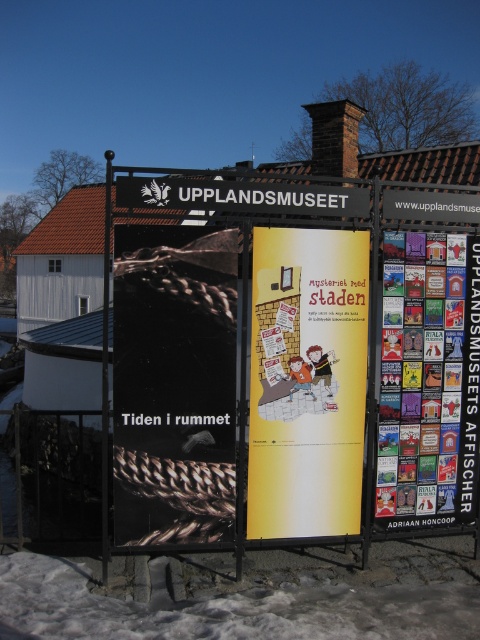
Which is above, black matte poster at center or white powdery snow at lower left?

Positioned higher is black matte poster at center.

Between point (264, 436) and point (79, 636), which one is positioned behind?

Positioned behind is point (264, 436).

Is point (216, 365) closer to camera compared to point (384, 611)?

No, it is behind (384, 611).

Locate an element on the screen. This screenshot has height=640, width=480. black matte poster at center is located at coordinates (296, 342).

Who is more distant from viewer, (253, 360) or (452, 444)?

Positioned behind is point (452, 444).

In the scene shown: Which is more to the left, yellow paper poster at center or multicolored paper posters at right?

yellow paper poster at center

Is point (302, 380) in front of point (429, 470)?

Yes, point (302, 380) is in front of point (429, 470).

Find the location of a particular element. yellow paper poster at center is located at coordinates (307, 381).

Does multicolored paper posters at right lie behind white powdery snow at lower left?

Yes, multicolored paper posters at right is behind white powdery snow at lower left.

Locate an element on the screen. This screenshot has width=480, height=640. multicolored paper posters at right is located at coordinates (430, 392).

Between point (383, 289) and point (8, 573), which one is positioned in front?

Point (8, 573) is in front.

Identify the location of multicolored paper posters at right. (430, 392).